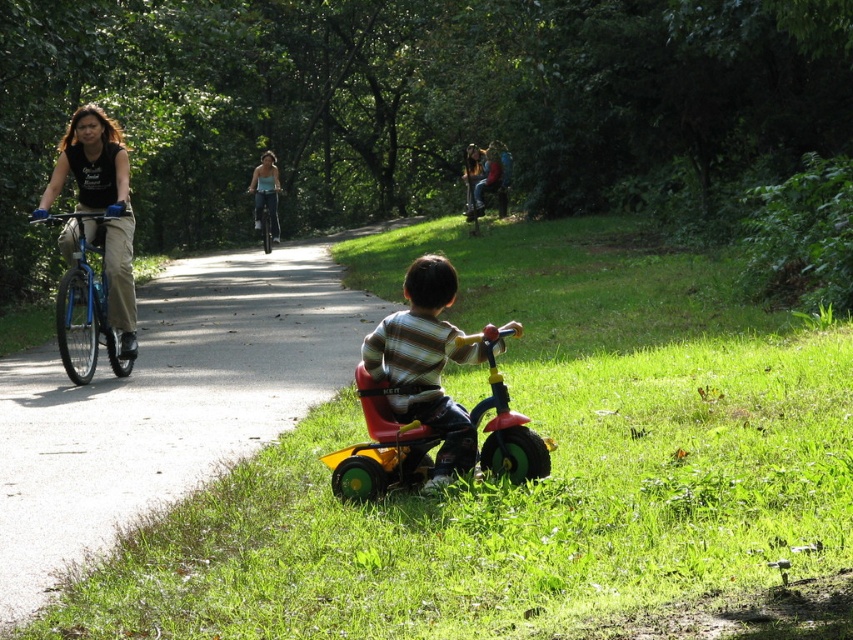
You are standing at the camera position in the scene. Which direction do you need to look to see the yellow plastic tricycle at lower center?

The yellow plastic tricycle at lower center is located at the lower center of the scene, so you should look downward toward the center to see it.

You are a parent trying to choose between two tricycles for your child. The yellow plastic tricycle at lower center and the matte plastic tricycle at lower center are both available. According to the image, which tricycle is bigger?

The yellow plastic tricycle at lower center is larger in size than the matte plastic tricycle at lower center, so the yellow plastic tricycle at lower center is bigger.

Consider the image. You are standing at the lower center of the image and want to walk to the blue metallic bicycle at left. Which direction should you move relative to the yellow plastic tricycle at lower center?

To reach the blue metallic bicycle at left from the lower center, you should move downward because the yellow plastic tricycle at lower center is located above the blue metallic bicycle at left.